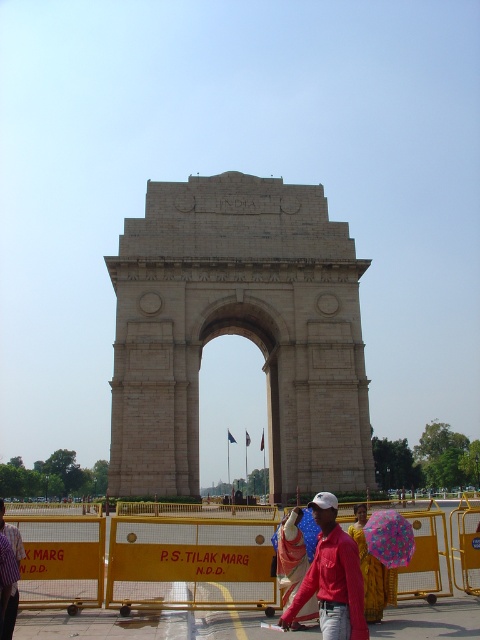
You are a tourist visiting India Gate and notice the beige stone arch at center and the red cotton shirt at center in the image. Which object is larger in size?

The beige stone arch at center is bigger than the red cotton shirt at center.

You are standing at the India Gate monument and want to take a photo of the two points marked on the ground. The first point is at coordinates point (381, 532) and the second point is at point (377, 584). Which point should you walk towards first to get closer to the monument?

Point (381, 532) is in front of point (377, 584), so you should walk towards point (381, 532) first to get closer to the monument.